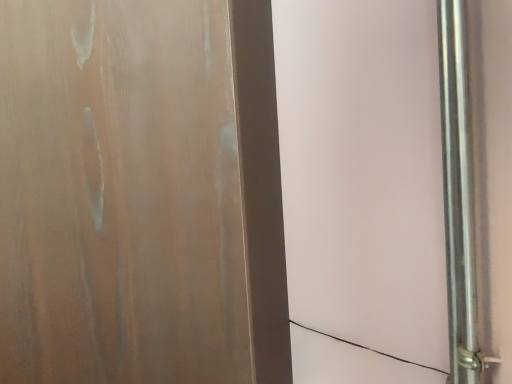
The image size is (512, 384). What do you see at coordinates (140, 194) in the screenshot?
I see `brushed metal door at left` at bounding box center [140, 194].

Locate an element on the screen. The image size is (512, 384). brushed metal door at left is located at coordinates (140, 194).

The height and width of the screenshot is (384, 512). Find the location of `brushed metal door at left`. brushed metal door at left is located at coordinates (140, 194).